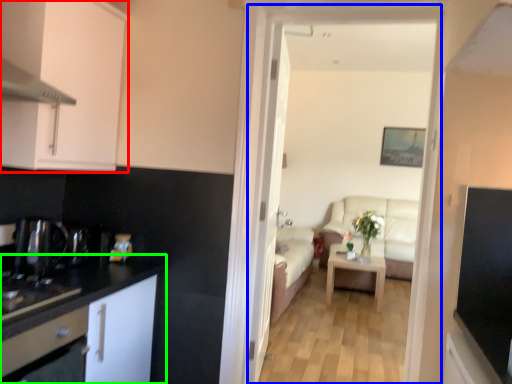
Question: Estimate the real-world distances between objects in this image. Which object is closer to cabinetry (highlighted by a red box), corridor (highlighted by a blue box) or cabinetry (highlighted by a green box)?

Choices:
 (A) corridor
 (B) cabinetry

Answer: (B)